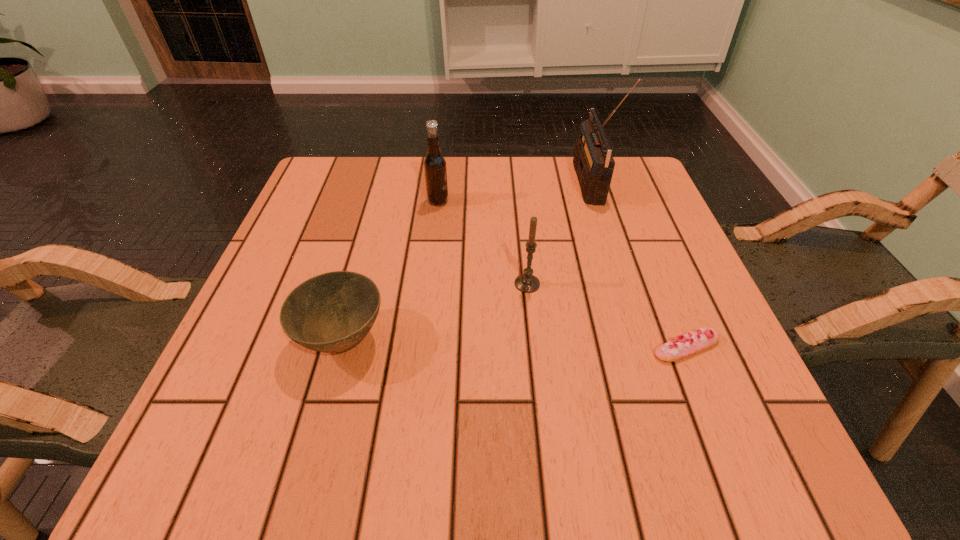
Where is `vacant area that satisfies the following two spatial constraints: 1. on the front side of the eclair; 2. on the right side of the third object from right to left`? This screenshot has width=960, height=540. vacant area that satisfies the following two spatial constraints: 1. on the front side of the eclair; 2. on the right side of the third object from right to left is located at coordinates (534, 347).

Identify the location of free space that satisfies the following two spatial constraints: 1. on the label of the fourth shortest object; 2. on the back side of the third shortest object. Image resolution: width=960 pixels, height=540 pixels. (428, 284).

Where is `vacant space that satisfies the following two spatial constraints: 1. on the label of the second object from left to right; 2. on the right side of the shortest object`? This screenshot has width=960, height=540. vacant space that satisfies the following two spatial constraints: 1. on the label of the second object from left to right; 2. on the right side of the shortest object is located at coordinates (421, 347).